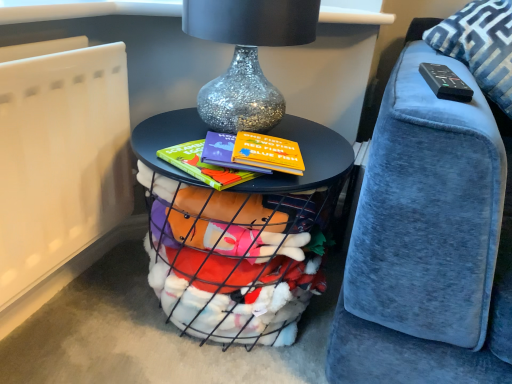
Question: Does blue velvet pillow at upper right lie in front of metallic wire basket at center?

Choices:
 (A) yes
 (B) no

Answer: (B)

Question: Does blue velvet pillow at upper right have a larger size compared to metallic wire basket at center?

Choices:
 (A) no
 (B) yes

Answer: (A)

Question: Is blue velvet pillow at upper right taller than metallic wire basket at center?

Choices:
 (A) no
 (B) yes

Answer: (A)

Question: Is blue velvet pillow at upper right to the left of metallic wire basket at center from the viewer's perspective?

Choices:
 (A) no
 (B) yes

Answer: (A)

Question: Is blue velvet pillow at upper right shorter than metallic wire basket at center?

Choices:
 (A) no
 (B) yes

Answer: (B)

Question: Would you say metallic wire basket at center is to the left or to the right of black plastic remote at upper right in the picture?

Choices:
 (A) right
 (B) left

Answer: (B)

Question: From the image's perspective, is metallic wire basket at center positioned above or below black plastic remote at upper right?

Choices:
 (A) below
 (B) above

Answer: (A)

Question: Is metallic wire basket at center inside the boundaries of black plastic remote at upper right, or outside?

Choices:
 (A) inside
 (B) outside

Answer: (B)

Question: Is metallic wire basket at center taller or shorter than black plastic remote at upper right?

Choices:
 (A) short
 (B) tall

Answer: (B)

Question: Which is correct: blue velvet pillow at upper right is inside black plastic remote at upper right, or outside of it?

Choices:
 (A) inside
 (B) outside

Answer: (B)

Question: Considering the relative positions of blue velvet pillow at upper right and black plastic remote at upper right in the image provided, is blue velvet pillow at upper right to the left or to the right of black plastic remote at upper right?

Choices:
 (A) right
 (B) left

Answer: (A)

Question: Is blue velvet pillow at upper right bigger or smaller than black plastic remote at upper right?

Choices:
 (A) big
 (B) small

Answer: (A)

Question: From the image's perspective, is blue velvet pillow at upper right positioned above or below black plastic remote at upper right?

Choices:
 (A) above
 (B) below

Answer: (A)

Question: From the image's perspective, is metallic wire basket at center positioned above or below white matte radiator at lower left?

Choices:
 (A) below
 (B) above

Answer: (A)

Question: Is metallic wire basket at center bigger or smaller than white matte radiator at lower left?

Choices:
 (A) small
 (B) big

Answer: (B)